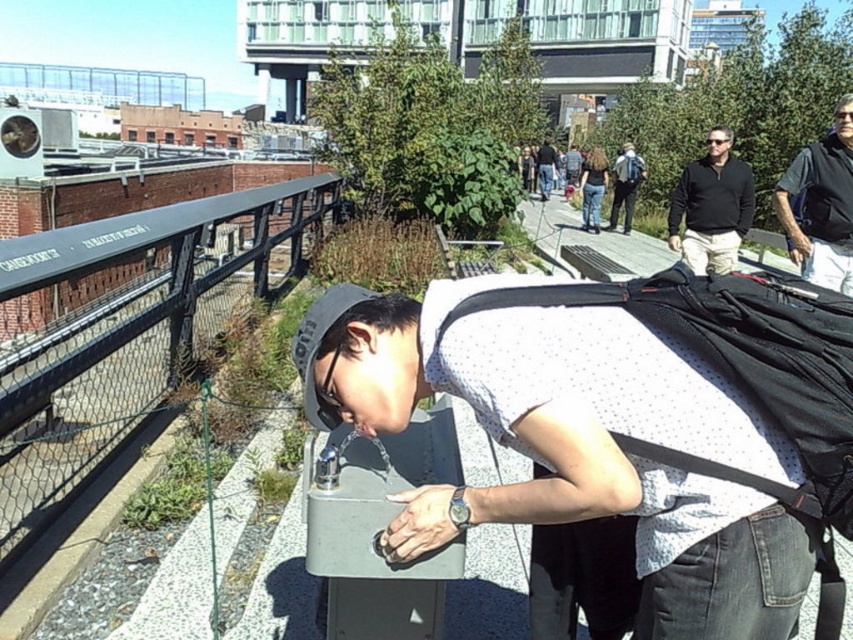
Question: Which point is closer to the camera?

Choices:
 (A) black metal rail at left
 (B) matte black sweater at upper right
 (C) matte black backpack at center
 (D) white dotted shirt at center

Answer: (D)

Question: Is dark gray shirt at upper right above matte black backpack at center?

Choices:
 (A) yes
 (B) no

Answer: (B)

Question: Does matte black backpack at center have a smaller size compared to dark blue jeans at center?

Choices:
 (A) no
 (B) yes

Answer: (A)

Question: Among these objects, which one is nearest to the camera?

Choices:
 (A) white dotted shirt at center
 (B) matte black backpack at center
 (C) matte black sweater at upper right

Answer: (A)

Question: Which point is closer to the camera?

Choices:
 (A) (596, 182)
 (B) (828, 237)
 (C) (51, 276)

Answer: (C)

Question: Is dark gray shirt at upper right above dark blue jeans at center?

Choices:
 (A) yes
 (B) no

Answer: (B)